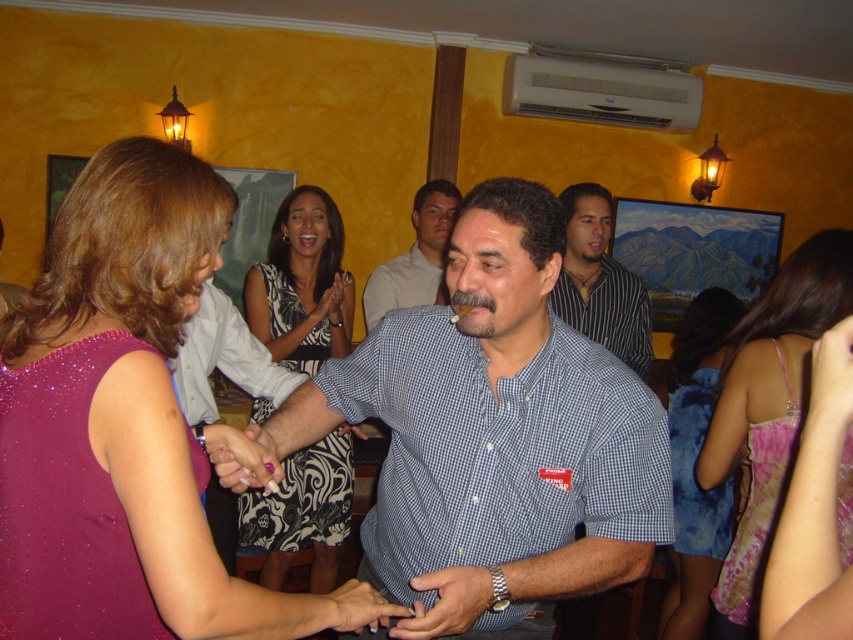
You are a photographer at the event and need to capture a closeup of both the striped shirt at center and the pink satin ring at center. Which object should you zoom in more on to ensure it fills the frame appropriately?

The striped shirt at center is wider than the pink satin ring at center, so you should zoom in more on the pink satin ring at center to ensure it fills the frame appropriately.

You are at a social gathering and see a point marked at coordinates (241,458). Which object is this point located on?

The point at (241,458) is located on the pink satin ring at center.

You are a photographer at this event and want to ensure both the purple sequined dress at center and the checkered shirt at center are clearly visible in your photo. Which object should you focus on first to ensure it doesn

The purple sequined dress at center is larger in size than the checkered shirt at center, so you should focus on the purple sequined dress at center first to ensure it is clearly visible before adjusting for the smaller checkered shirt at center.